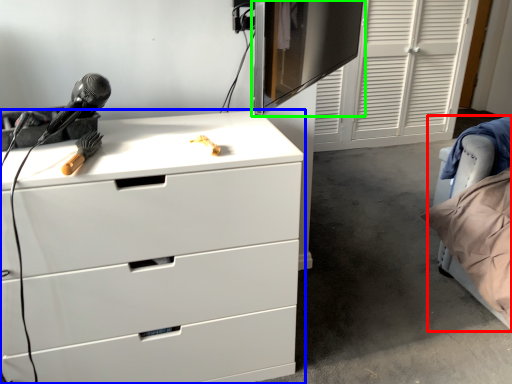
Question: Estimate the real-world distances between objects in this image. Which object is farther from bed (highlighted by a red box), chest of drawers (highlighted by a blue box) or computer monitor (highlighted by a green box)?

Choices:
 (A) chest of drawers
 (B) computer monitor

Answer: (B)